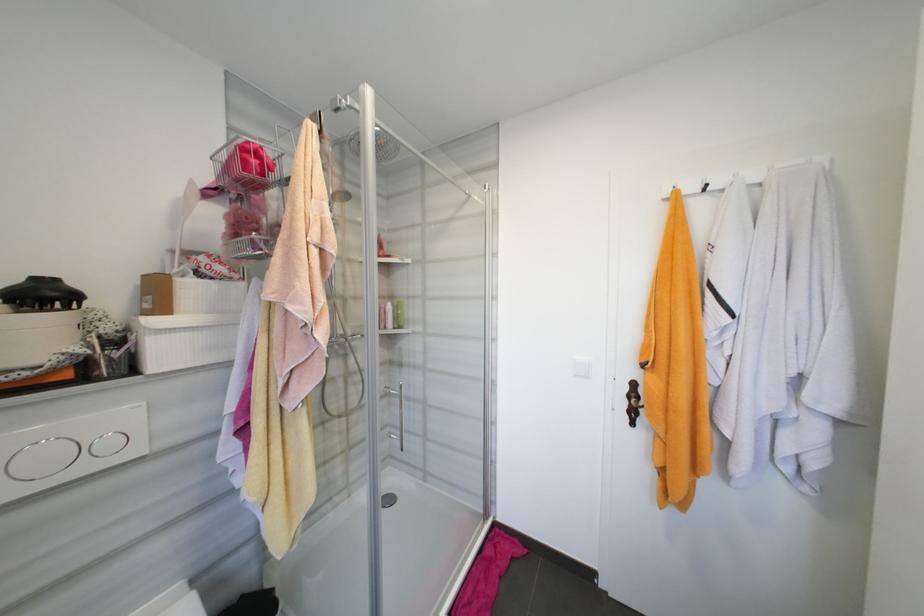
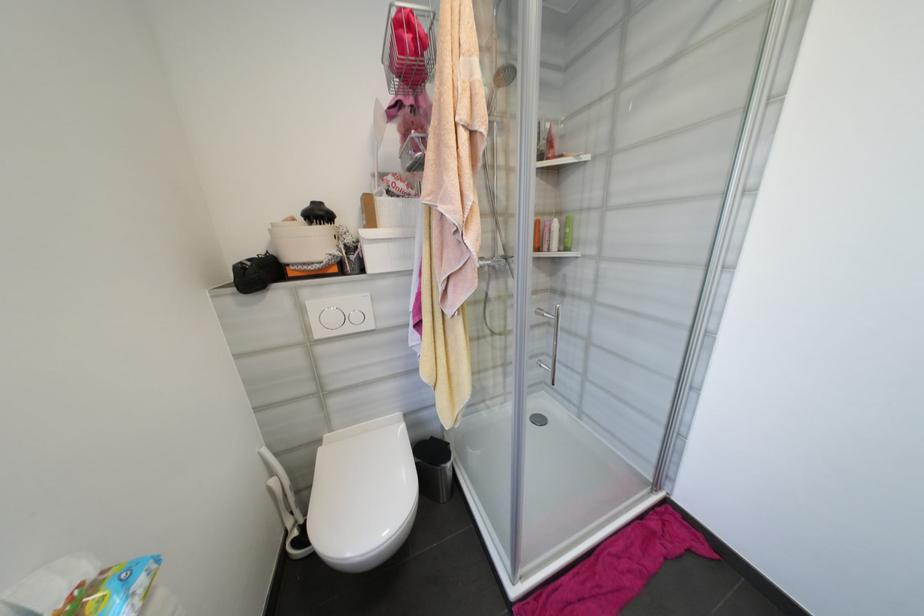
Question: I am providing you with two images of the same scene from different viewpoints. Please identify which objects are invisible in image2.

Choices:
 (A) orange bottle
 (B) small flush button
 (C) toilet brush handle
 (D) none of these

Answer: (D)